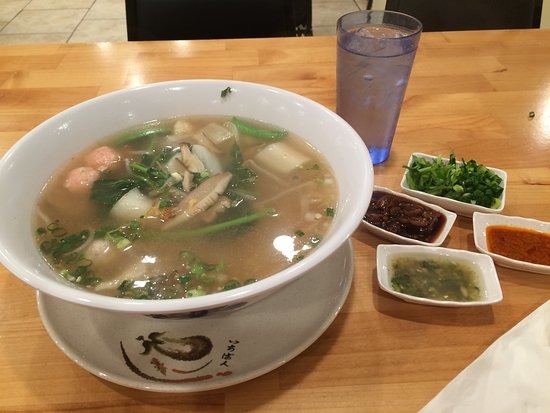
The image size is (550, 413). In order to click on chairs in this screenshot , I will do `click(268, 27)`, `click(456, 15)`.